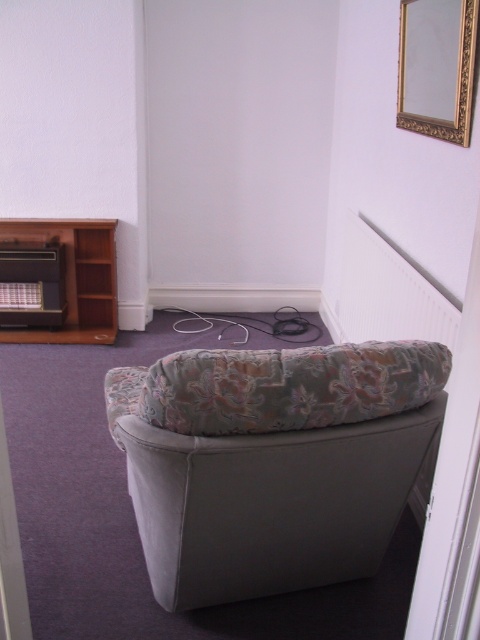
You are sitting in the gray upholstered armchair with a floral pattern and looking at the gold ornate picture frame at upper right and the brown wooden bookshelf at left. Which object is higher up in the room?

The gold ornate picture frame at upper right is above the brown wooden bookshelf at left, so it is higher up in the room.